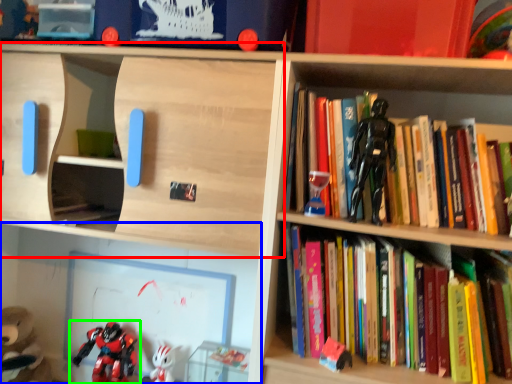
Question: Considering the real-world distances, which object is farthest from shelf (highlighted by a red box)? shelf (highlighted by a blue box) or toy (highlighted by a green box)?

Choices:
 (A) shelf
 (B) toy

Answer: (B)